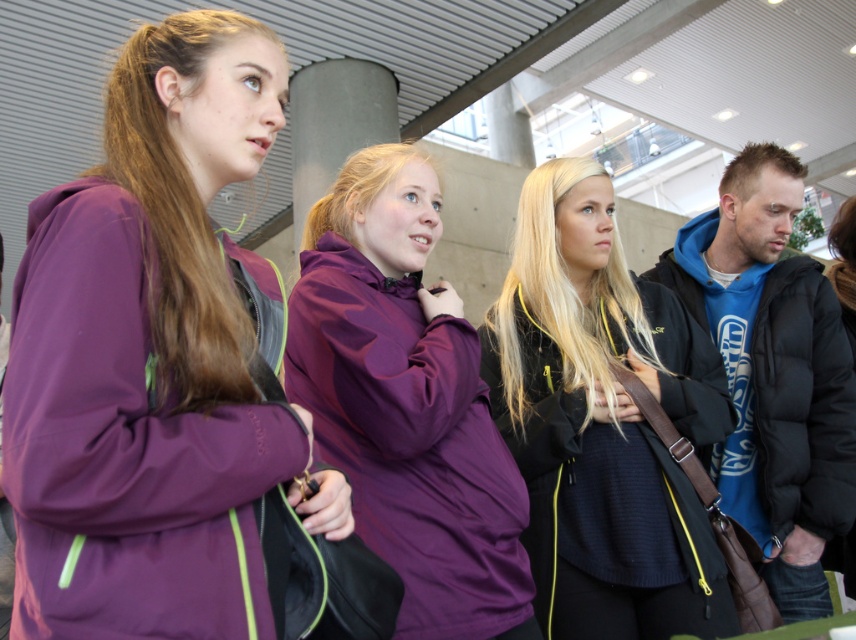
You are a photographer trying to capture a candid shot of the purple softshell jacket at left and the purple matte jacket at center. Since you want to focus on both jackets, which one should you adjust your camera angle to prioritize in the frame?

The purple softshell jacket at left is located above the purple matte jacket at center, so adjusting the camera angle to prioritize the purple softshell jacket at left would ensure both are in the frame.